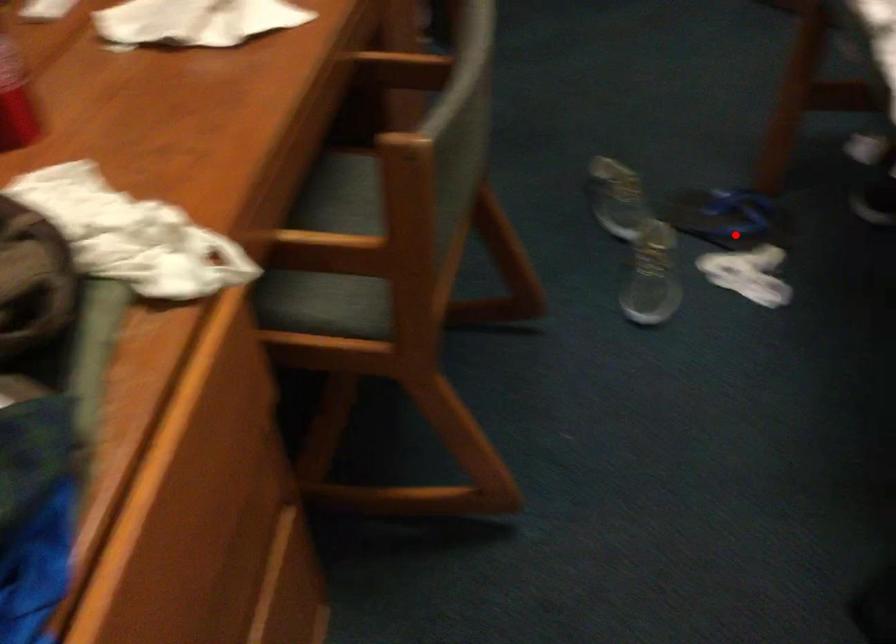
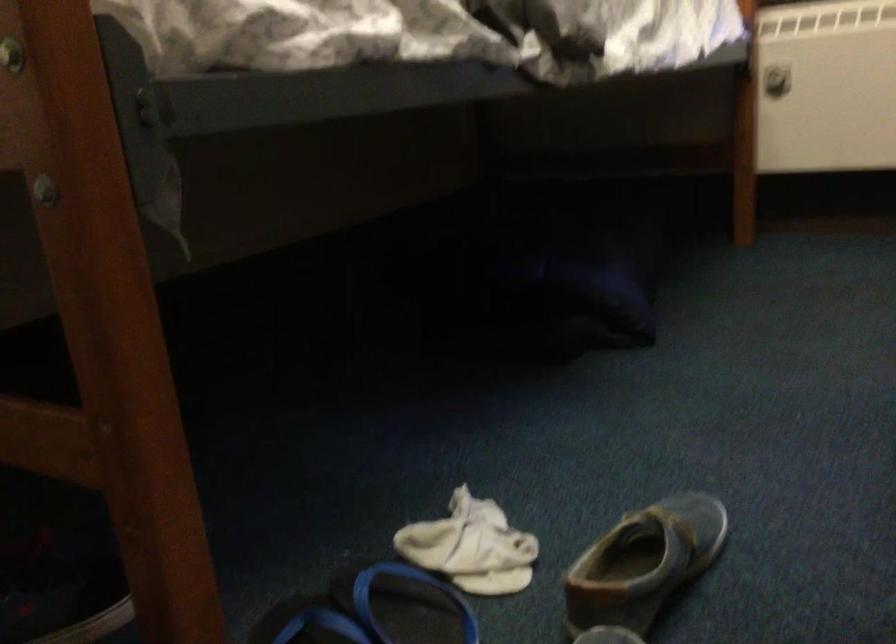
Question: I am providing you with two images of the same scene from different viewpoints. Given a red point in image1, look at the same physical point in image2. Is it:

Choices:
 (A) Closer to the viewpoint
 (B) Farther from the viewpoint

Answer: (A)